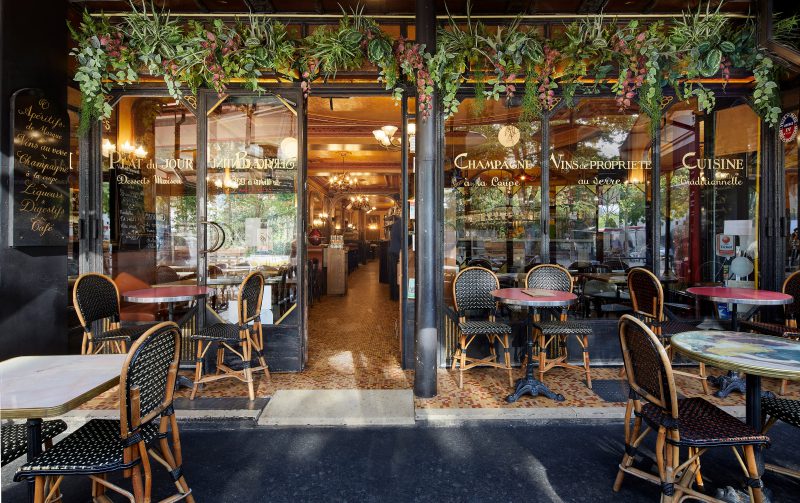
This screenshot has width=800, height=503. Identify the location of grassy spider plant like greenery. (153, 32), (260, 30), (346, 41), (470, 30), (522, 39), (596, 30), (706, 31).